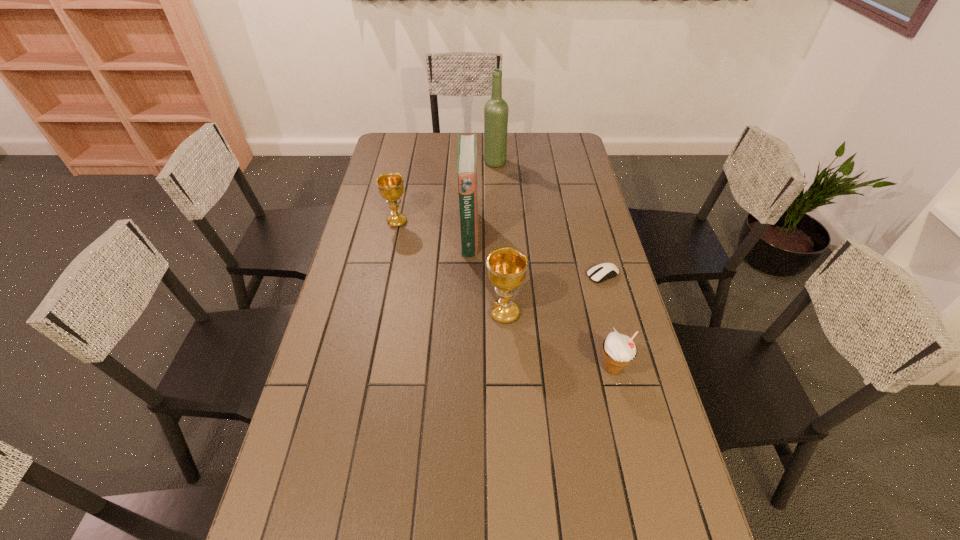
At what (x,y) coordinates should I click in order to perform the action: click on icecream present at the right edge. Please return your answer as a coordinate pair (x, y). The width and height of the screenshot is (960, 540). Looking at the image, I should click on (619, 350).

Where is `vacant space at the near edge`? Image resolution: width=960 pixels, height=540 pixels. vacant space at the near edge is located at coordinates (410, 526).

Identify the location of free space at the left edge of the desktop. (332, 341).

Find the location of a particular element. blank space at the right edge of the desktop is located at coordinates (563, 242).

You are a GUI agent. You are given a task and a screenshot of the screen. Output one action in this format:
    pyautogui.click(x=<x>, y=<y>)
    Task: Click on the free space at the far left corner of the desktop
    Image resolution: width=960 pixels, height=540 pixels.
    Given the screenshot: What is the action you would take?
    [x=400, y=133]

You are a GUI agent. You are given a task and a screenshot of the screen. Output one action in this format:
    pyautogui.click(x=<x>, y=<y>)
    Task: Click on the free space at the far right corner
    Image resolution: width=960 pixels, height=540 pixels.
    Given the screenshot: What is the action you would take?
    pyautogui.click(x=564, y=133)

Identify the location of free spot between the wine bottle and the hardback book. (482, 198).

At what (x,y) coordinates should I click in order to perform the action: click on vacant region between the shorter chalice and the fourth shortest object. Please return your answer as a coordinate pair (x, y). The height and width of the screenshot is (540, 960). Looking at the image, I should click on [451, 268].

Identify the location of empty space that is in between the second object from left to right and the fourth farthest object. (537, 255).

Locate an element on the screen. This screenshot has height=540, width=960. free point between the wine bottle and the second shortest object is located at coordinates (554, 266).